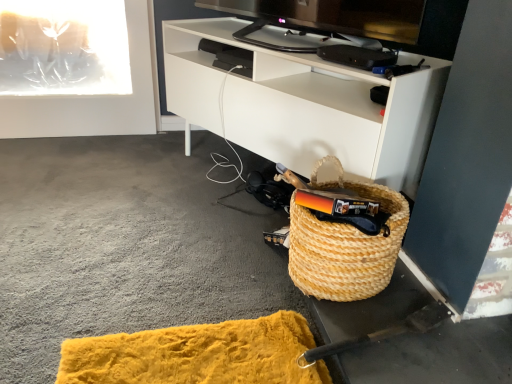
I want to click on natural woven basket at lower right, so click(344, 245).

Describe the element at coordinates (344, 245) in the screenshot. I see `natural woven basket at lower right` at that location.

Where is `white matte cabinet at lower right`? white matte cabinet at lower right is located at coordinates (305, 106).

What do you see at coordinates (305, 106) in the screenshot? The height and width of the screenshot is (384, 512). I see `white matte cabinet at lower right` at bounding box center [305, 106].

Measure the distance between point (221, 33) and camera.

5.53 feet.

Locate an element on the screen. The width and height of the screenshot is (512, 384). natural woven basket at lower right is located at coordinates (344, 245).

Which object is positioned more to the right, natural woven basket at lower right or white matte cabinet at lower right?

natural woven basket at lower right.

Is natural woven basket at lower right closer to camera compared to white matte cabinet at lower right?

Yes.

Does point (377, 269) come in front of point (330, 66)?

That is True.

From the image's perspective, is natural woven basket at lower right below white matte cabinet at lower right?

Yes, from the image's perspective, natural woven basket at lower right is beneath white matte cabinet at lower right.

From a real-world perspective, does natural woven basket at lower right stand above white matte cabinet at lower right?

Incorrect, from a real-world perspective, natural woven basket at lower right is lower than white matte cabinet at lower right.

Which object is thinner, natural woven basket at lower right or white matte cabinet at lower right?

With smaller width is natural woven basket at lower right.

From their relative heights in the image, would you say natural woven basket at lower right is taller or shorter than white matte cabinet at lower right?

Clearly, natural woven basket at lower right is shorter compared to white matte cabinet at lower right.

Consider the image. Does natural woven basket at lower right have a larger size compared to white matte cabinet at lower right?

No, natural woven basket at lower right is not bigger than white matte cabinet at lower right.

Would you say natural woven basket at lower right is inside or outside white matte cabinet at lower right?

natural woven basket at lower right is not enclosed by white matte cabinet at lower right.

Is natural woven basket at lower right with white matte cabinet at lower right?

No, natural woven basket at lower right is not in contact with white matte cabinet at lower right.

Looking at this image, is natural woven basket at lower right aimed at white matte cabinet at lower right?

No, natural woven basket at lower right does not turn towards white matte cabinet at lower right.

Where is `picnic basket on the right side of white matte cabinet at lower right`? picnic basket on the right side of white matte cabinet at lower right is located at coordinates (344, 245).

Between white matte cabinet at lower right and natural woven basket at lower right, which one appears on the right side from the viewer's perspective?

From the viewer's perspective, natural woven basket at lower right appears more on the right side.

Consider the image. Relative to natural woven basket at lower right, is white matte cabinet at lower right in front or behind?

Visually, white matte cabinet at lower right is located behind natural woven basket at lower right.

Which point is more forward, (x=390, y=160) or (x=316, y=297)?

The point (x=316, y=297) is more forward.

From the image's perspective, which one is positioned higher, white matte cabinet at lower right or natural woven basket at lower right?

white matte cabinet at lower right.

From a real-world perspective, is white matte cabinet at lower right beneath natural woven basket at lower right?

No, from a real-world perspective, white matte cabinet at lower right is not beneath natural woven basket at lower right.

Can you confirm if white matte cabinet at lower right is thinner than natural woven basket at lower right?

In fact, white matte cabinet at lower right might be wider than natural woven basket at lower right.

Is white matte cabinet at lower right taller or shorter than natural woven basket at lower right?

white matte cabinet at lower right is taller than natural woven basket at lower right.

Consider the image. Which of these two, white matte cabinet at lower right or natural woven basket at lower right, is bigger?

white matte cabinet at lower right is bigger.

Is natural woven basket at lower right located within white matte cabinet at lower right?

No, natural woven basket at lower right is not a part of white matte cabinet at lower right.

Does white matte cabinet at lower right touch natural woven basket at lower right?

No, white matte cabinet at lower right is not beside natural woven basket at lower right.

Is white matte cabinet at lower right oriented towards natural woven basket at lower right?

Yes, white matte cabinet at lower right is aimed at natural woven basket at lower right.

Measure the distance between white matte cabinet at lower right and natural woven basket at lower right.

13.63 inches.

I want to click on picnic basket lying below the white matte cabinet at lower right (from the image's perspective), so click(x=344, y=245).

I want to click on cabinetry above the natural woven basket at lower right (from a real-world perspective), so click(x=305, y=106).

Locate an element on the screen. Image resolution: width=512 pixels, height=384 pixels. cabinetry lying on the left of natural woven basket at lower right is located at coordinates (305, 106).